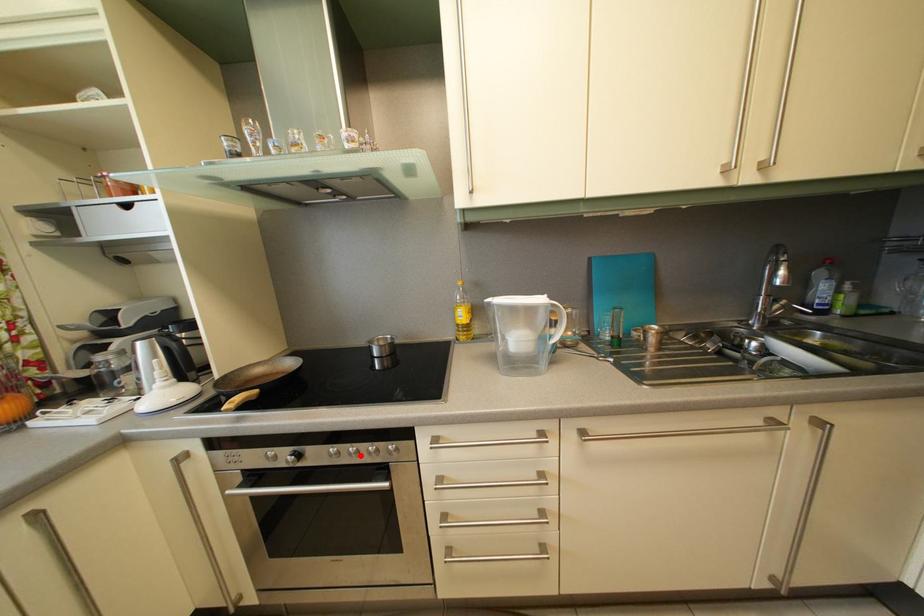
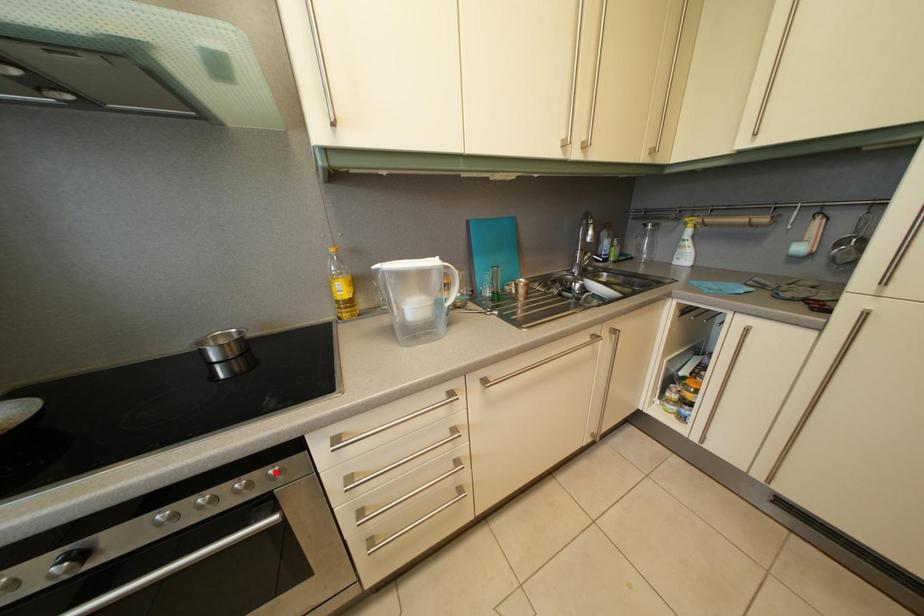
I am providing you with two images of the same scene from different viewpoints. A red point is marked on the first image and another point is marked on the second image. Do the highlighted points in image1 and image2 indicate the same real-world spot?

No